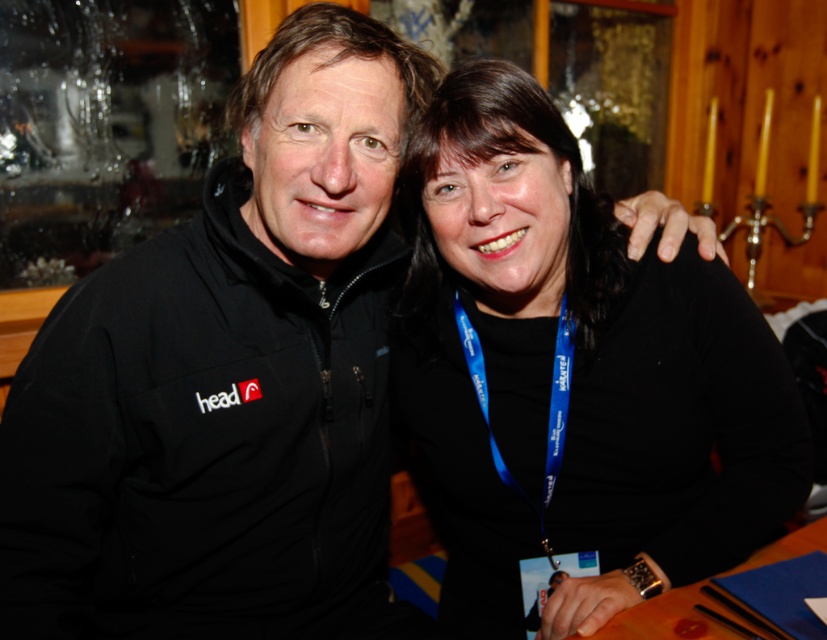
Question: Which point is farther from the camera taking this photo?

Choices:
 (A) (571, 564)
 (B) (625, 356)

Answer: (A)

Question: Which object is positioned farthest from the wooden table at lower right?

Choices:
 (A) blue fabric lanyard at lower center
 (B) black matte shirt at center

Answer: (B)

Question: Which of the following is the closest to the observer?

Choices:
 (A) black matte shirt at center
 (B) blue fabric lanyard at lower center
 (C) wooden table at lower right

Answer: (C)

Question: Is black matte shirt at center positioned before blue fabric lanyard at lower center?

Choices:
 (A) no
 (B) yes

Answer: (B)

Question: Is black matte shirt at center to the right of wooden table at lower right from the viewer's perspective?

Choices:
 (A) no
 (B) yes

Answer: (A)

Question: Can you confirm if black matte shirt at center is bigger than wooden table at lower right?

Choices:
 (A) yes
 (B) no

Answer: (A)